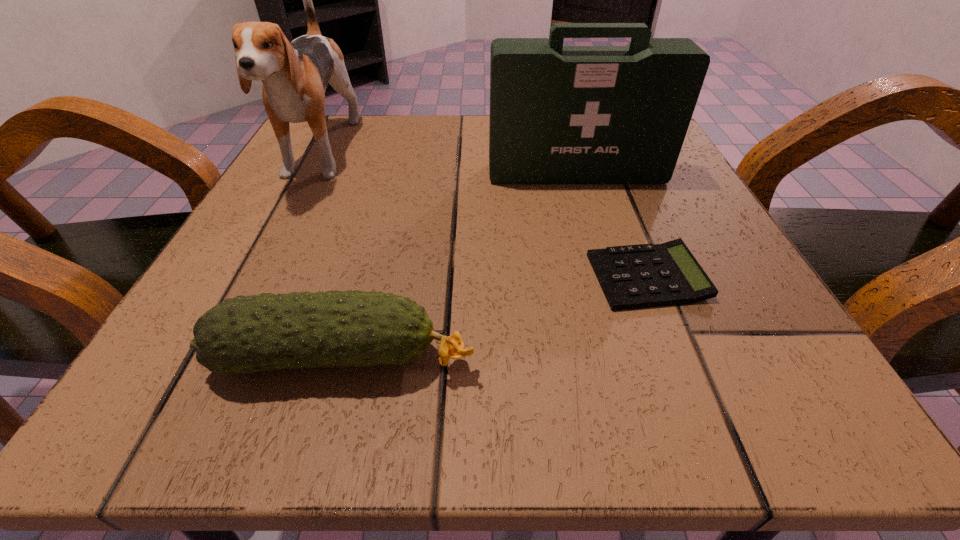
Locate an element on the screen. The width and height of the screenshot is (960, 540). free space that satisfies the following two spatial constraints: 1. on the front-facing side of the third shortest object; 2. on the right side of the calculator is located at coordinates (607, 277).

The image size is (960, 540). Find the location of `free region that satisfies the following two spatial constraints: 1. at the face of the tallest object; 2. on the left side of the shortest object`. free region that satisfies the following two spatial constraints: 1. at the face of the tallest object; 2. on the left side of the shortest object is located at coordinates (255, 277).

Identify the location of free spot that satisfies the following two spatial constraints: 1. on the front side of the calculator; 2. at the blossom end of the third tallest object. (678, 357).

At what (x,y) coordinates should I click in order to perform the action: click on free spot that satisfies the following two spatial constraints: 1. at the face of the puppy; 2. on the left side of the calculator. Please return your answer as a coordinate pair (x, y). Looking at the image, I should click on (255, 277).

Find the location of a particular element. This screenshot has width=960, height=540. vacant space that satisfies the following two spatial constraints: 1. on the front-facing side of the first-aid kit; 2. at the blossom end of the second shortest object is located at coordinates (631, 357).

This screenshot has height=540, width=960. I want to click on vacant point that satisfies the following two spatial constraints: 1. on the front-facing side of the first-aid kit; 2. on the left side of the calculator, so click(607, 277).